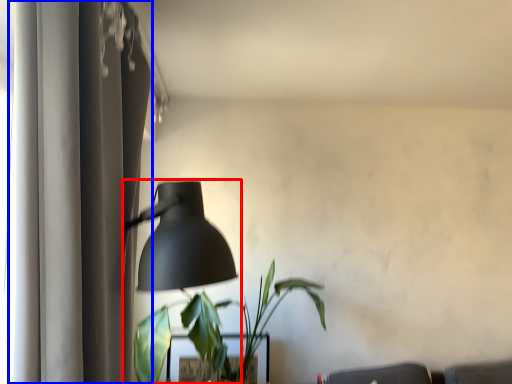
Question: Which object is closer to the camera taking this photo, lamp (highlighted by a red box) or curtain (highlighted by a blue box)?

Choices:
 (A) lamp
 (B) curtain

Answer: (B)